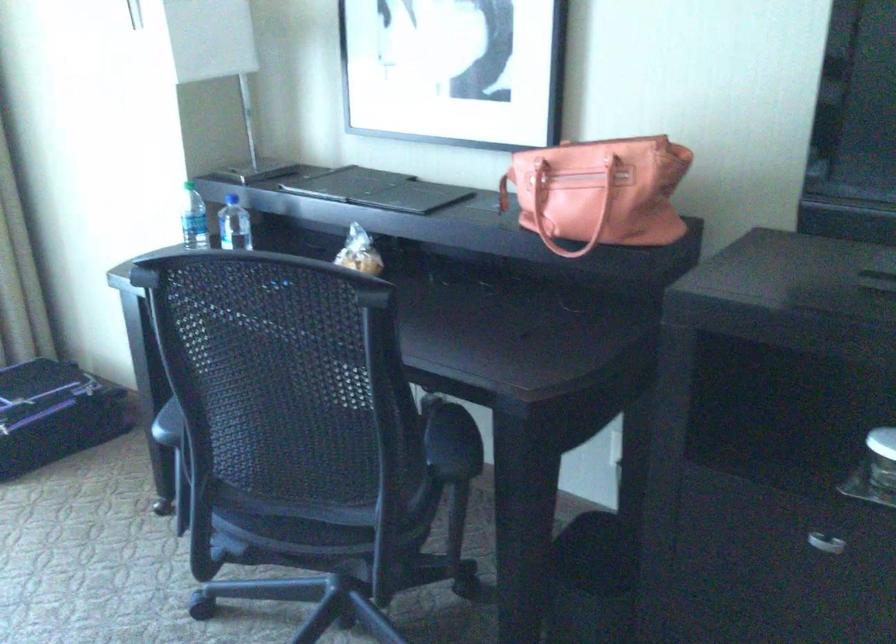
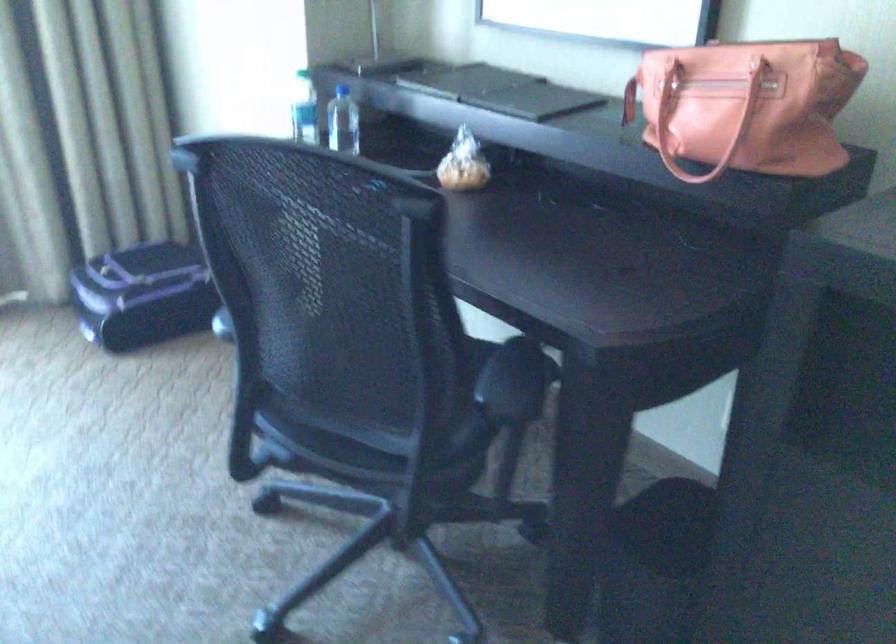
Find the pixel in the second image that matches point 502,193 in the first image.

(629, 100)